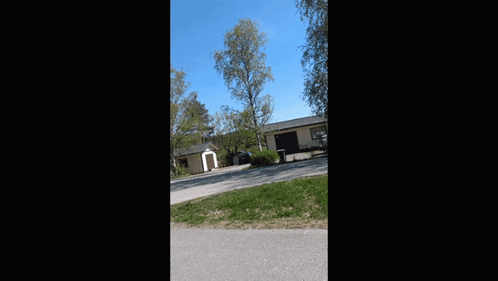
Identify the location of white penthouse. This screenshot has width=498, height=281. (193, 149).